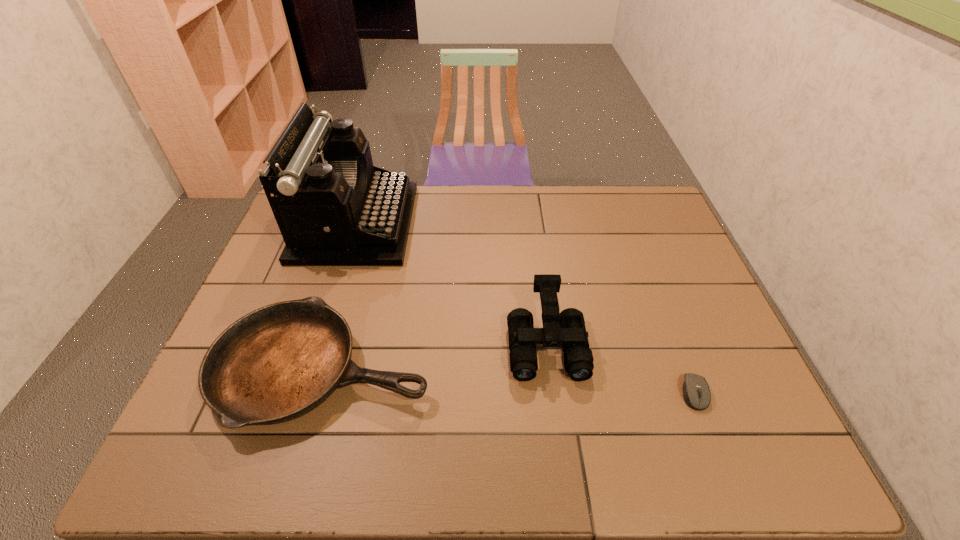
This screenshot has width=960, height=540. I want to click on free point between the rightmost object and the typewriter, so click(x=525, y=308).

This screenshot has height=540, width=960. Identify the location of object that can be found as the closest to the third tallest object. (333, 207).

Choose which object is the nearest neighbor to the rightmost object. Please provide its 2D coordinates. Your answer should be formatted as a tuple, i.e. [(x, y)], where the tuple contains the x and y coordinates of a point satisfying the conditions above.

[(567, 329)]

At what (x,y) coordinates should I click in order to perform the action: click on free location that satisfies the following two spatial constraints: 1. on the front lenses of the third shortest object; 2. on the left side of the shortest object. Please return your answer as a coordinate pair (x, y). Looking at the image, I should click on (553, 393).

Identify the location of vacant region that satisfies the following two spatial constraints: 1. on the typing side of the third tallest object; 2. on the left side of the typewriter. This screenshot has height=540, width=960. (309, 369).

Where is `free location that satisfies the following two spatial constraints: 1. on the front lenses of the computer equipment; 2. on the left side of the second object from right to left`? The image size is (960, 540). free location that satisfies the following two spatial constraints: 1. on the front lenses of the computer equipment; 2. on the left side of the second object from right to left is located at coordinates (553, 393).

At what (x,y) coordinates should I click in order to perform the action: click on free space that satisfies the following two spatial constraints: 1. on the back side of the rightmost object; 2. on the typing side of the farthest object. Please return your answer as a coordinate pair (x, y). The width and height of the screenshot is (960, 540). Looking at the image, I should click on (630, 223).

Image resolution: width=960 pixels, height=540 pixels. In order to click on vacant area in the image that satisfies the following two spatial constraints: 1. on the front lenses of the third object from left to right; 2. on the left side of the rightmost object in this screenshot , I will do `click(553, 393)`.

You are a GUI agent. You are given a task and a screenshot of the screen. Output one action in this format:
    pyautogui.click(x=<x>, y=<y>)
    Task: Click on the blank space that satisfies the following two spatial constraints: 1. on the front lenses of the third shortest object; 2. on the left side of the shortest object
    Image resolution: width=960 pixels, height=540 pixels.
    Given the screenshot: What is the action you would take?
    pyautogui.click(x=553, y=393)

Locate an element on the screen. The image size is (960, 540). blank area in the image that satisfies the following two spatial constraints: 1. on the typing side of the farthest object; 2. on the right side of the shortest object is located at coordinates [301, 393].